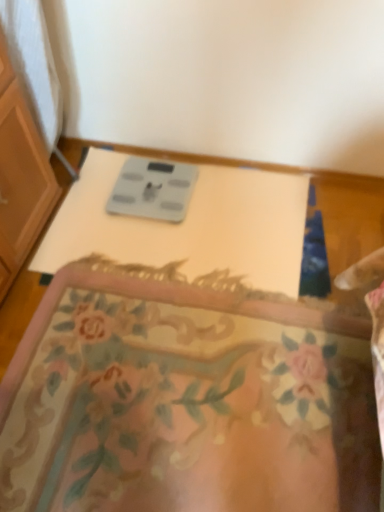
Measure the distance between floral carpet at center and camera.

The distance of floral carpet at center from camera is 3.38 feet.

What is the approximate height of gray matte scale at center?

gray matte scale at center is 1.12 inches tall.

Identify the location of floral carpet at center. This screenshot has height=512, width=384. (185, 400).

Is point (292, 292) in front of point (184, 182)?

Yes, point (292, 292) is closer to viewer.

The width and height of the screenshot is (384, 512). In order to click on scale that is under the gray plastic scale at center (from a real-world perspective) in this screenshot , I will do `click(153, 189)`.

Does gray plastic scale at center have a larger size compared to gray matte scale at center?

Yes, gray plastic scale at center is bigger than gray matte scale at center.

Which object is positioned more to the left, gray plastic scale at center or gray matte scale at center?

gray matte scale at center is more to the left.

Which object is wider, gray matte scale at center or floral carpet at center?

With larger width is floral carpet at center.

You are a GUI agent. You are given a task and a screenshot of the screen. Output one action in this format:
    pyautogui.click(x=<x>, y=<y>)
    Task: Click on the scale located behind the floral carpet at center
    This screenshot has width=384, height=512.
    Given the screenshot: What is the action you would take?
    153,189

Is gray matte scale at center taller than floral carpet at center?

Incorrect, the height of gray matte scale at center is not larger of that of floral carpet at center.

Would you consider gray matte scale at center to be distant from floral carpet at center?

No, there isn't a large distance between gray matte scale at center and floral carpet at center.

Is floral carpet at center far away from gray matte scale at center?

No, there isn't a large distance between floral carpet at center and gray matte scale at center.

Is floral carpet at center further to camera compared to gray matte scale at center?

No, floral carpet at center is closer to the viewer.

From a real-world perspective, which is physically below, floral carpet at center or gray matte scale at center?

gray matte scale at center is physically lower.

Which object is thinner, floral carpet at center or gray matte scale at center?

gray matte scale at center is thinner.

Considering the sizes of objects floral carpet at center and gray plastic scale at center in the image provided, who is bigger, floral carpet at center or gray plastic scale at center?

With larger size is floral carpet at center.

Which is further, (10, 407) or (81, 231)?

The point (81, 231) is behind.

Considering the sizes of objects floral carpet at center and gray plastic scale at center in the image provided, who is taller, floral carpet at center or gray plastic scale at center?

With more height is gray plastic scale at center.

Find the location of a particular element. The width and height of the screenshot is (384, 512). mat below the gray plastic scale at center (from a real-world perspective) is located at coordinates (185, 400).

How many degrees apart are the facing directions of gray plastic scale at center and floral carpet at center?

gray plastic scale at center and floral carpet at center are facing 180 degrees away from each other.

Is gray plastic scale at center at the right side of floral carpet at center?

In fact, gray plastic scale at center is to the left of floral carpet at center.

From the image's perspective, which object appears higher, gray plastic scale at center or floral carpet at center?

gray plastic scale at center appears higher in the image.

Is gray matte scale at center oriented towards gray plastic scale at center?

Yes, gray matte scale at center faces towards gray plastic scale at center.

Identify the location of changing table that appears on the right of gray matte scale at center. (188, 225).

Would you say gray matte scale at center is outside gray plastic scale at center?

Actually, gray matte scale at center is within gray plastic scale at center.

Looking at their sizes, would you say gray matte scale at center is wider or thinner than gray plastic scale at center?

Clearly, gray matte scale at center has less width compared to gray plastic scale at center.

Where is `scale that appears on the left of gray plastic scale at center`? This screenshot has height=512, width=384. scale that appears on the left of gray plastic scale at center is located at coordinates (153, 189).

Where is `scale lying above the floral carpet at center (from the image's perspective)`? scale lying above the floral carpet at center (from the image's perspective) is located at coordinates (153, 189).

Considering their positions, is gray plastic scale at center positioned closer to floral carpet at center than gray matte scale at center?

The object closer to floral carpet at center is gray plastic scale at center.

Which object lies further to the anchor point floral carpet at center, gray matte scale at center or gray plastic scale at center?

gray matte scale at center.

Which object lies nearer to the anchor point gray matte scale at center, floral carpet at center or gray plastic scale at center?

gray plastic scale at center is positioned closer to the anchor gray matte scale at center.

Based on their spatial positions, is gray plastic scale at center or floral carpet at center closer to gray matte scale at center?

gray plastic scale at center lies closer to gray matte scale at center than the other object.

Which object lies nearer to the anchor point gray plastic scale at center, floral carpet at center or gray matte scale at center?

The object closer to gray plastic scale at center is gray matte scale at center.

From the image, which object appears to be nearer to gray plastic scale at center, gray matte scale at center or floral carpet at center?

Among the two, gray matte scale at center is located nearer to gray plastic scale at center.

At what (x,y) coordinates should I click in order to perform the action: click on changing table located between floral carpet at center and gray matte scale at center in the depth direction. Please return your answer as a coordinate pair (x, y). The width and height of the screenshot is (384, 512). Looking at the image, I should click on (188, 225).